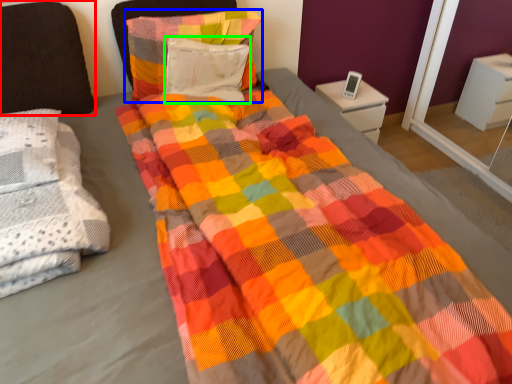
Question: Based on their relative distances, which object is nearer to pillow (highlighted by a red box)? Choose from pillow (highlighted by a blue box) and pillow (highlighted by a green box).

Choices:
 (A) pillow
 (B) pillow

Answer: (A)